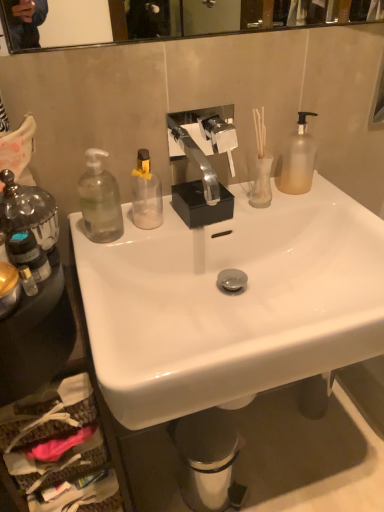
The image size is (384, 512). I want to click on vacant space to the right of translucent glass vase at upper right, so click(x=318, y=201).